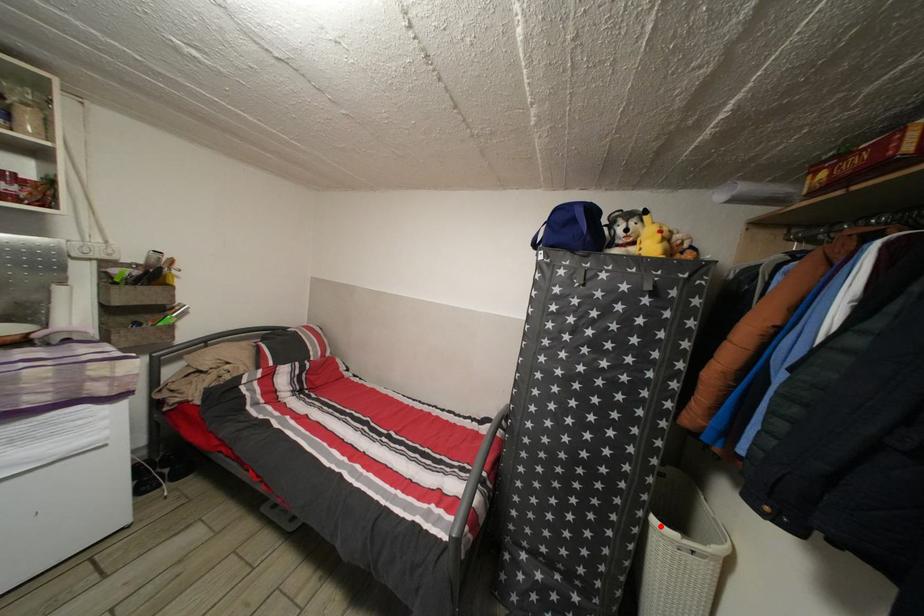
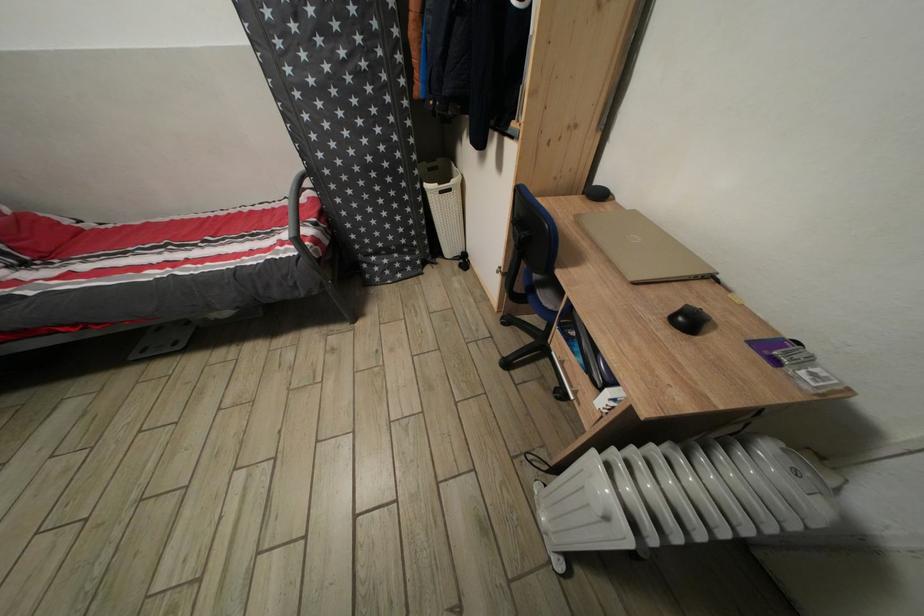
Question: I am providing you with two images of the same scene from different viewpoints. A red point is shown in image1. For the corresponding object point in image2, is it positioned nearer or farther from the camera?

Choices:
 (A) Nearer
 (B) Farther

Answer: (A)